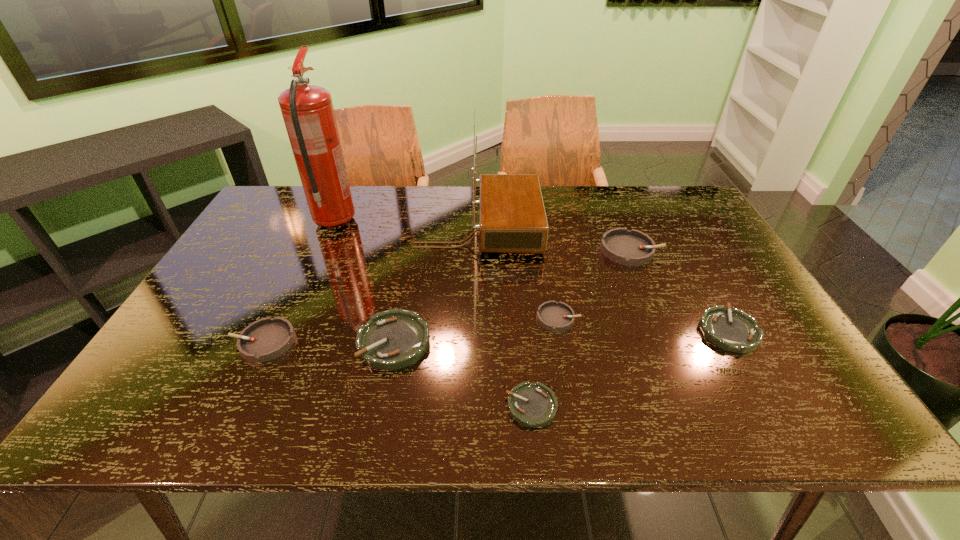
Identify the location of free space between the second smallest gray ashtray and the biggest gray ashtray. Image resolution: width=960 pixels, height=540 pixels. (447, 295).

You are a GUI agent. You are given a task and a screenshot of the screen. Output one action in this format:
    pyautogui.click(x=<x>, y=<y>)
    Task: Click on the second closest object relative to the biggest green ashtray
    Image resolution: width=960 pixels, height=540 pixels.
    Given the screenshot: What is the action you would take?
    pyautogui.click(x=534, y=405)

Select which object appears as the seventh closest to the second tallest object. Please provide its 2D coordinates. Your answer should be formatted as a tuple, i.e. [(x, y)], where the tuple contains the x and y coordinates of a point satisfying the conditions above.

[(534, 405)]

Identify which ashtray is located as the second nearest to the rightmost green ashtray. Please provide its 2D coordinates. Your answer should be formatted as a tuple, i.e. [(x, y)], where the tuple contains the x and y coordinates of a point satisfying the conditions above.

[(555, 316)]

I want to click on ashtray that can be found as the fourth closest to the rightmost green ashtray, so click(393, 339).

Find the location of a particular element. The width and height of the screenshot is (960, 540). gray ashtray that is the second closest to the leftmost green ashtray is located at coordinates (555, 316).

The width and height of the screenshot is (960, 540). What are the coordinates of `the closest gray ashtray relative to the second gray ashtray from left to right` in the screenshot? It's located at pyautogui.click(x=632, y=247).

Image resolution: width=960 pixels, height=540 pixels. In order to click on green ashtray that stands as the second closest to the biggest green ashtray in this screenshot , I will do `click(733, 330)`.

Locate which green ashtray is the second closest to the smallest green ashtray. Please provide its 2D coordinates. Your answer should be formatted as a tuple, i.e. [(x, y)], where the tuple contains the x and y coordinates of a point satisfying the conditions above.

[(733, 330)]

Find the location of a particular element. The image size is (960, 540). vacant space that satisfies the following two spatial constraints: 1. on the front panel of the smallest gray ashtray; 2. on the right side of the radio_receiver is located at coordinates (478, 318).